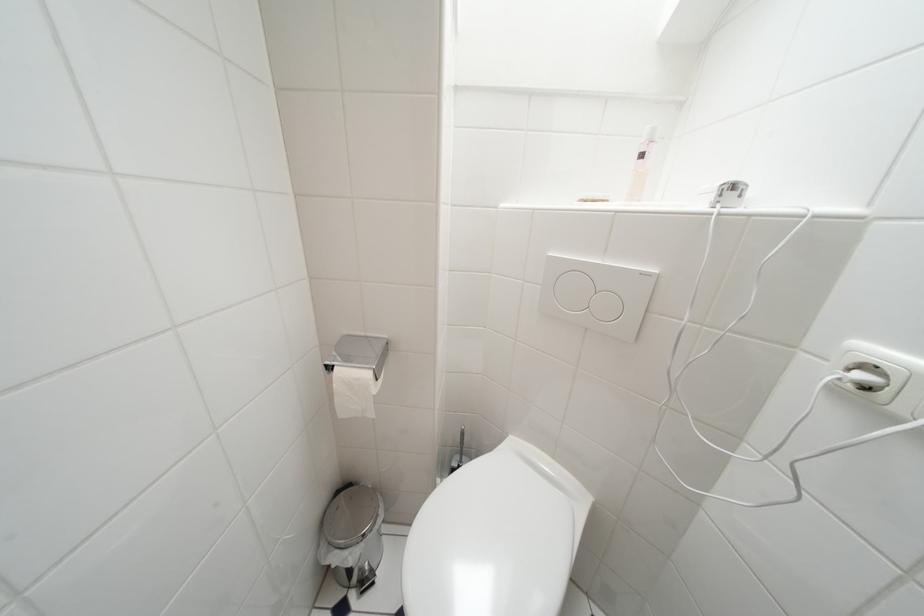
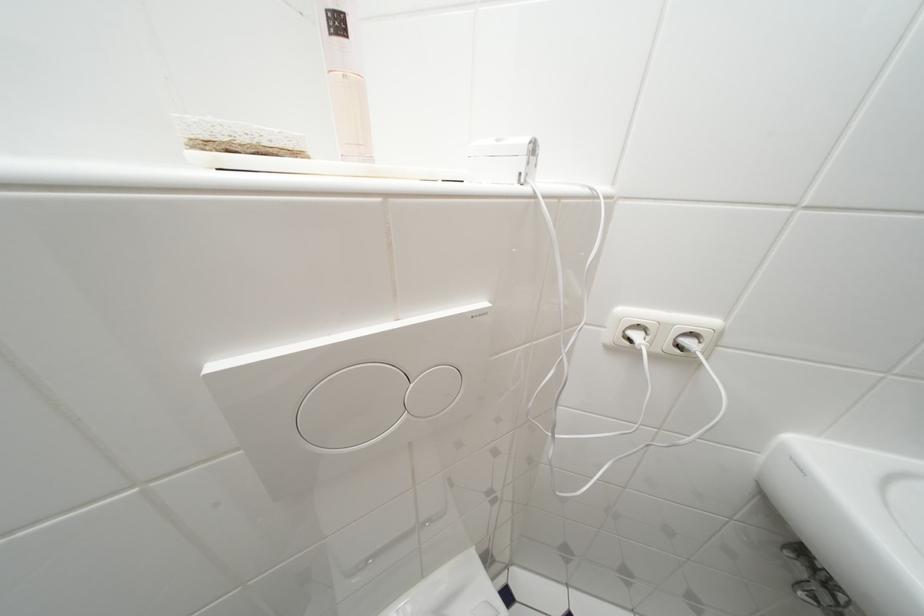
Find the pixel in the second image that matches point 726,199 in the first image.

(535, 166)